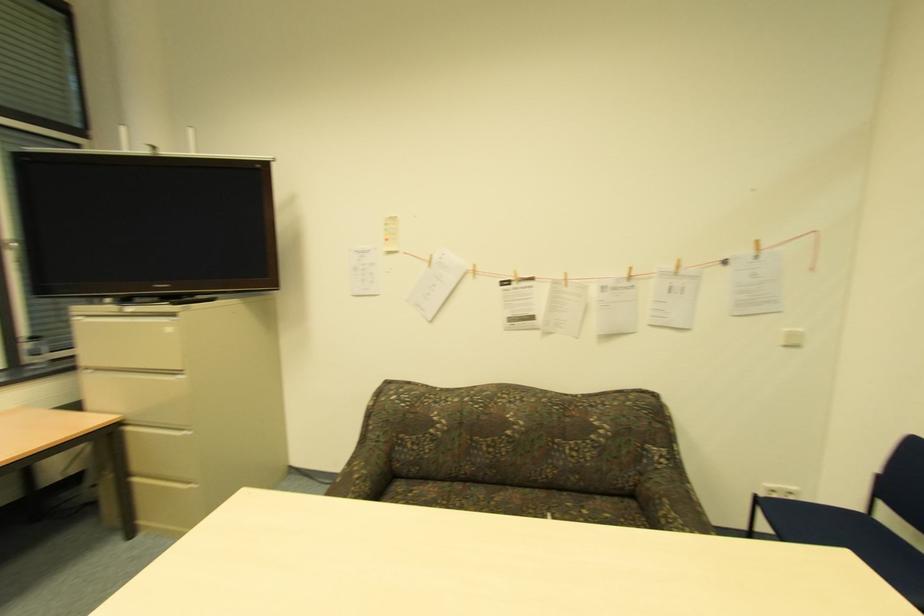
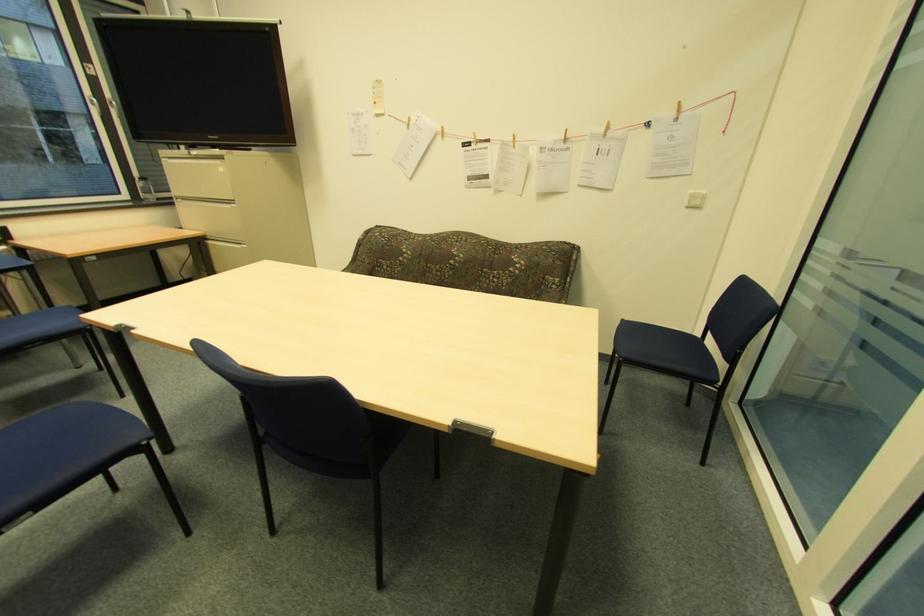
What movement of the cameraman would produce the second image?

The movement direction of the cameraman is right, backward.